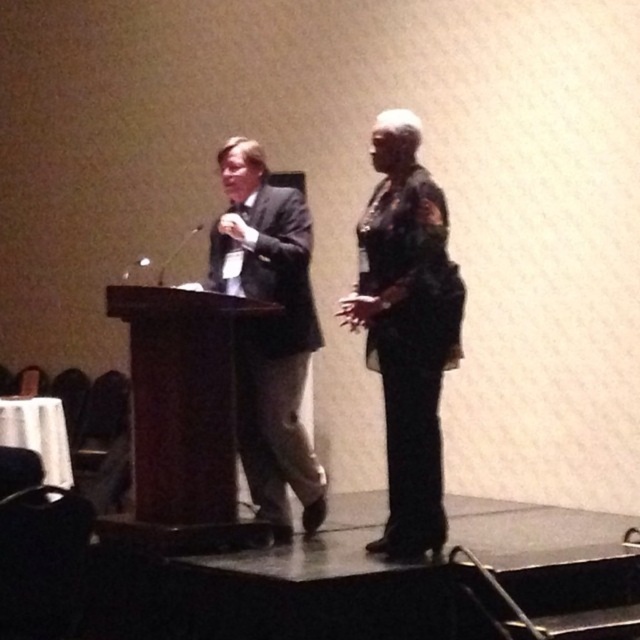
Who is more forward, (218, 404) or (282, 464)?

Point (218, 404) is in front.

Is point (232, 540) positioned before point (305, 474)?

Yes, it is in front of point (305, 474).

Where is `brown wood podium at center`? This screenshot has height=640, width=640. brown wood podium at center is located at coordinates (182, 420).

Where is `dark green textured blazer at center`? The height and width of the screenshot is (640, 640). dark green textured blazer at center is located at coordinates [406, 326].

Is dark green textured blazer at center above brown wood podium at center?

Yes, dark green textured blazer at center is above brown wood podium at center.

Between point (371, 208) and point (193, 550), which one is positioned behind?

The point (371, 208) is behind.

This screenshot has width=640, height=640. What are the coordinates of `dark green textured blazer at center` in the screenshot? It's located at (x=406, y=326).

Does dark green textured blazer at center come in front of dark gray suit at center?

Yes, it is in front of dark gray suit at center.

Is dark green textured blazer at center taller than dark gray suit at center?

No, dark green textured blazer at center is not taller than dark gray suit at center.

Which is behind, point (397, 483) or point (266, 364)?

The point (266, 364) is behind.

Locate an element on the screen. dark green textured blazer at center is located at coordinates [x=406, y=326].